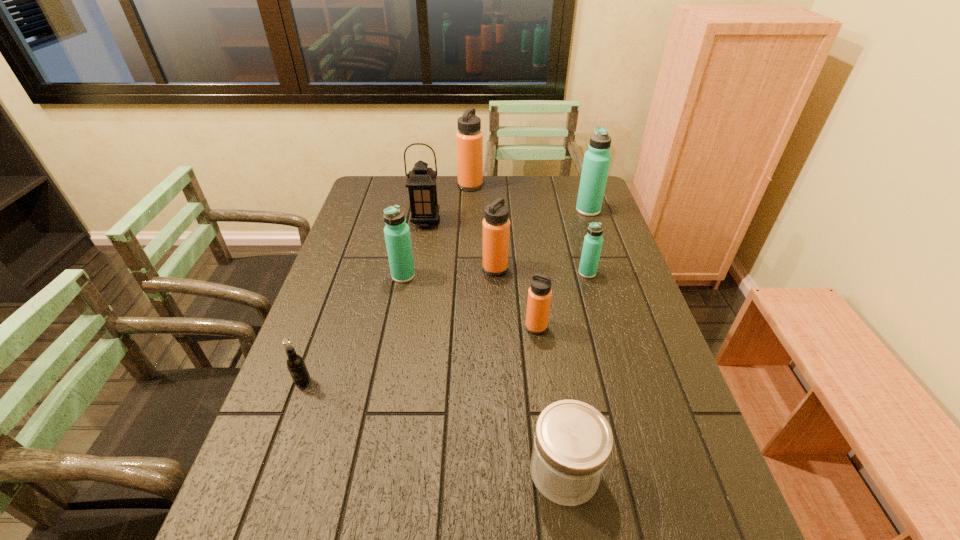
Where is `the farthest object`? This screenshot has width=960, height=540. the farthest object is located at coordinates (469, 138).

I want to click on the farthest thermos bottle, so click(469, 138).

The width and height of the screenshot is (960, 540). Identify the location of the biggest aqua thermos bottle. (596, 163).

Find the location of `the second farthest thermos bottle`. the second farthest thermos bottle is located at coordinates (596, 163).

Locate an element on the screen. This screenshot has width=960, height=540. black lantern is located at coordinates (421, 182).

At what (x,y) coordinates should I click in order to perform the action: click on the leftmost aqua thermos bottle. Please return your answer as a coordinate pair (x, y). The image size is (960, 540). Looking at the image, I should click on (397, 232).

Locate an element on the screen. The width and height of the screenshot is (960, 540). the second smallest aqua thermos bottle is located at coordinates (397, 232).

Image resolution: width=960 pixels, height=540 pixels. Identify the location of the second nearest orange thermos bottle. (496, 226).

Find the location of a particular element. Image resolution: width=960 pixels, height=540 pixels. the smallest aqua thermos bottle is located at coordinates (593, 241).

Identify the location of the nearest thermos bottle. The image size is (960, 540). (539, 294).